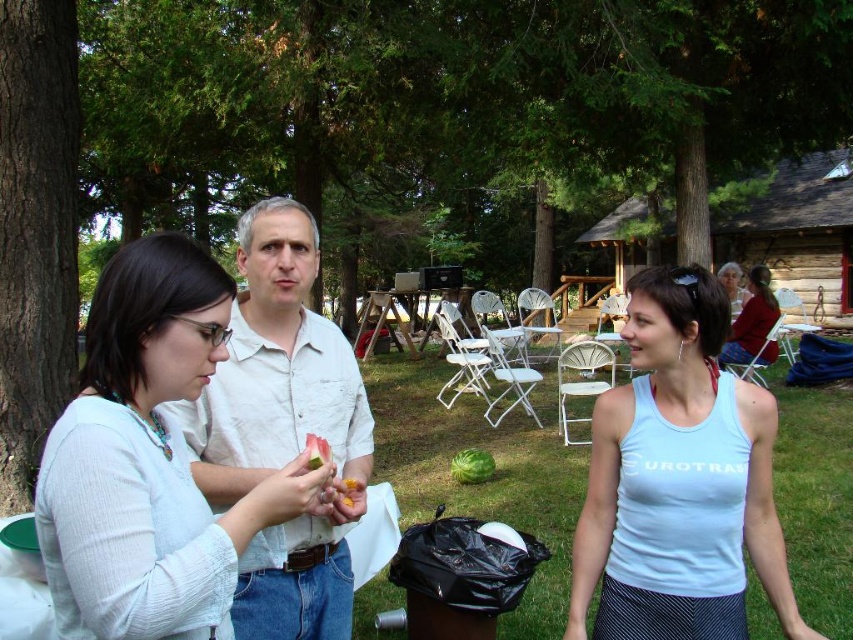
You are at an outdoor gathering and see the matte white shirt at center and the green matte watermelon at center. Which object takes up more space in the image?

The matte white shirt at center is larger in size than the green matte watermelon at center, so it takes up more space in the image.

You are standing in the grassy area and want to hand the white tank top at center to someone behind the brown rough bark tree at left. Can you directly hand it without moving the tank top or the tree?

The white tank top at center is closer to the viewer than the brown rough bark tree at left, so you cannot directly hand it to someone behind the tree without moving either object.

You are standing at the origin of the coordinate system in the image. There is a point at coordinates (282, 428). What object is located at this point?

The point at coordinates (282, 428) corresponds to the white cotton shirt at center.